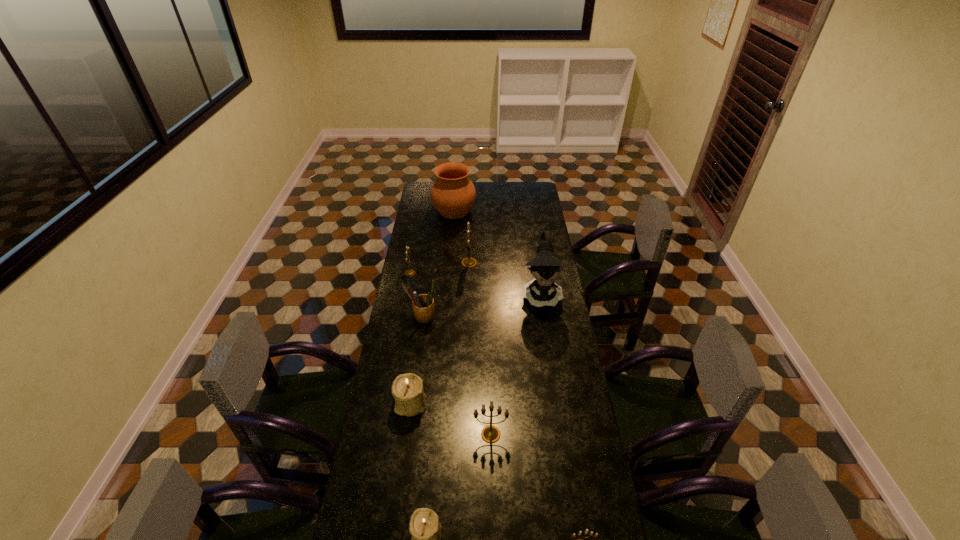
The height and width of the screenshot is (540, 960). What are the coordinates of `the second closest candelabrum to the tallest candelabrum` in the screenshot? It's located at (407, 389).

Identify which candelabrum is the closest to the leftmost gold candelabrum. Please provide its 2D coordinates. Your answer should be formatted as a tuple, i.e. [(x, y)], where the tuple contains the x and y coordinates of a point satisfying the conditions above.

[(468, 262)]

Image resolution: width=960 pixels, height=540 pixels. Find the location of `gold candelabrum object that ranks as the closest to the brown pencil box`. gold candelabrum object that ranks as the closest to the brown pencil box is located at coordinates (411, 272).

Select which gold candelabrum appears as the third closest to the pottery. Please provide its 2D coordinates. Your answer should be formatted as a tuple, i.e. [(x, y)], where the tuple contains the x and y coordinates of a point satisfying the conditions above.

[(490, 434)]

Where is `vacant point that satisfies the following two spatial constraints: 1. on the back side of the leftmost gold candelabrum; 2. on the left side of the tallest candelabrum`? This screenshot has height=540, width=960. vacant point that satisfies the following two spatial constraints: 1. on the back side of the leftmost gold candelabrum; 2. on the left side of the tallest candelabrum is located at coordinates (412, 263).